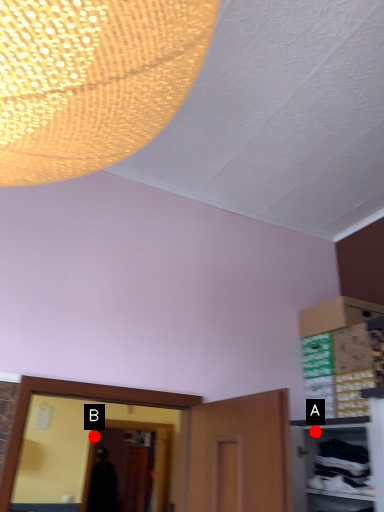
Question: Two points are circled on the image, labeled by A and B beside each circle. Which point appears closest to the camera in this image?

Choices:
 (A) A is closer
 (B) B is closer

Answer: (A)